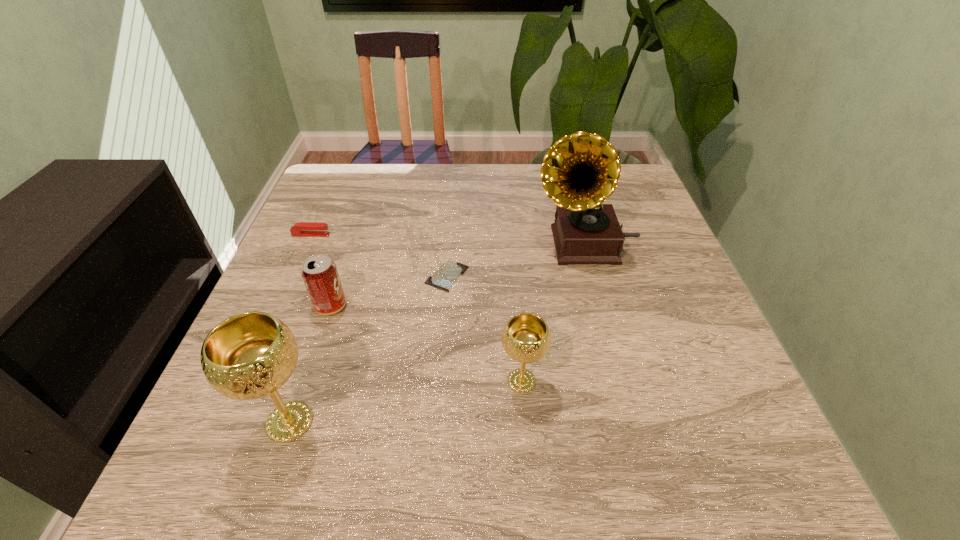
Find the location of `the left chalice`. the left chalice is located at coordinates (250, 355).

This screenshot has height=540, width=960. I want to click on the second tallest object, so click(x=250, y=355).

Identify the location of the second object from right to left. Image resolution: width=960 pixels, height=540 pixels. (526, 338).

Where is `the right chalice`? This screenshot has height=540, width=960. the right chalice is located at coordinates (526, 338).

Locate an element on the screen. the tallest object is located at coordinates (580, 171).

Identify the location of the rightmost object. The image size is (960, 540). (580, 171).

This screenshot has width=960, height=540. I want to click on soda can, so click(319, 273).

Image resolution: width=960 pixels, height=540 pixels. Identify the location of the third shortest object. (319, 273).

You are a GUI agent. You are given a task and a screenshot of the screen. Output one action in this format:
    pyautogui.click(x=<x>, y=<y>)
    Task: Click on the fourth object from left to right
    The height and width of the screenshot is (540, 960).
    Given the screenshot: What is the action you would take?
    pyautogui.click(x=446, y=275)

You are a GUI agent. You are given a task and a screenshot of the screen. Output one action in this format:
    pyautogui.click(x=<x>, y=<y>)
    Task: Click on the shortest object
    
    Given the screenshot: What is the action you would take?
    pyautogui.click(x=446, y=275)